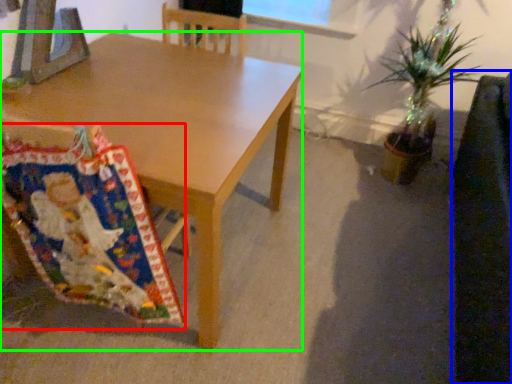
Question: Estimate the real-world distances between objects in this image. Which object is closer to blanket (highlighted by a red box), swivel chair (highlighted by a blue box) or desk (highlighted by a green box)?

Choices:
 (A) swivel chair
 (B) desk

Answer: (B)